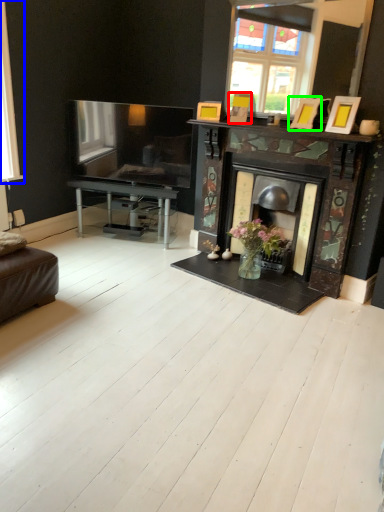
Question: Estimate the real-world distances between objects in this image. Which object is closer to picture frame (highlighted by a red box), window (highlighted by a blue box) or picture frame (highlighted by a green box)?

Choices:
 (A) window
 (B) picture frame

Answer: (B)